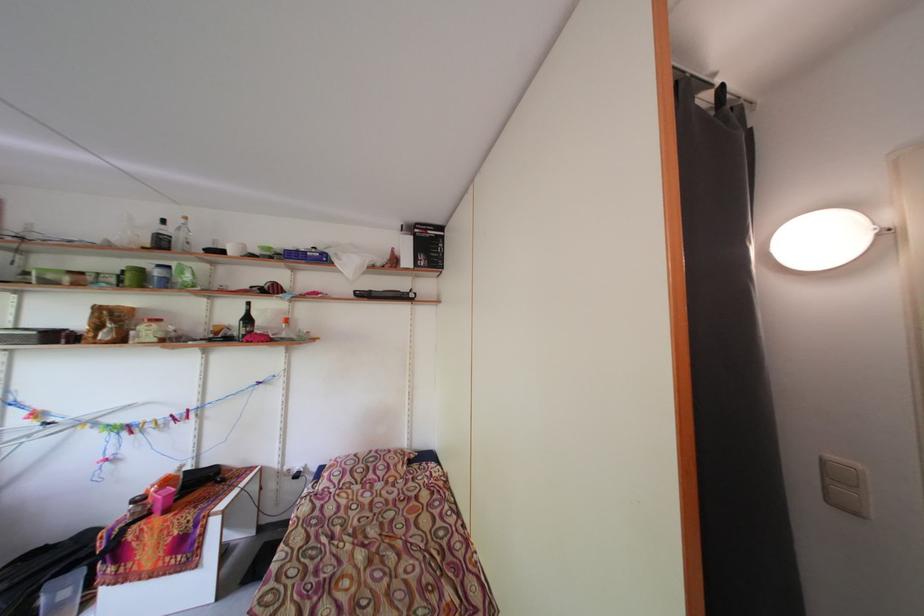
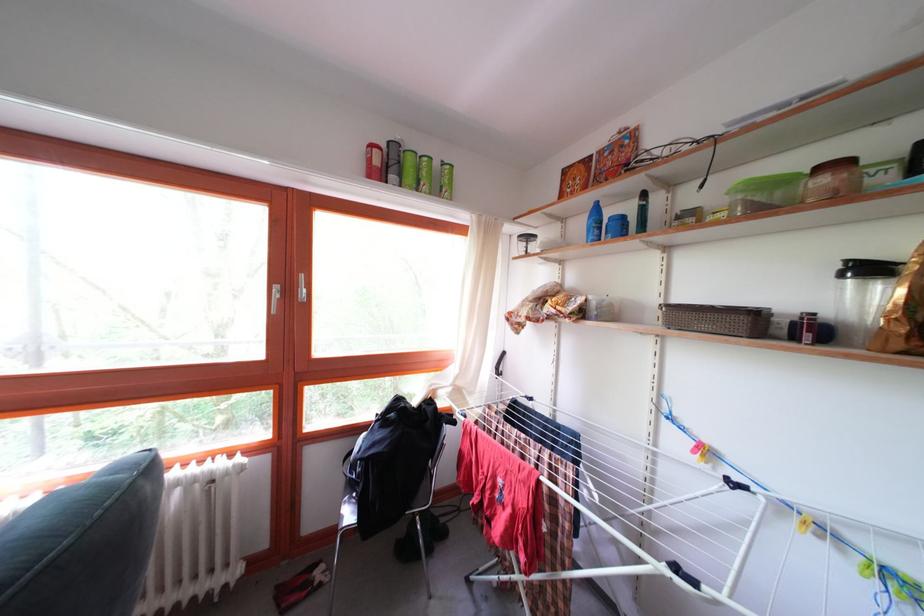
Find the pixel in the second image that matches (x=75, y=284) in the first image.

(832, 187)